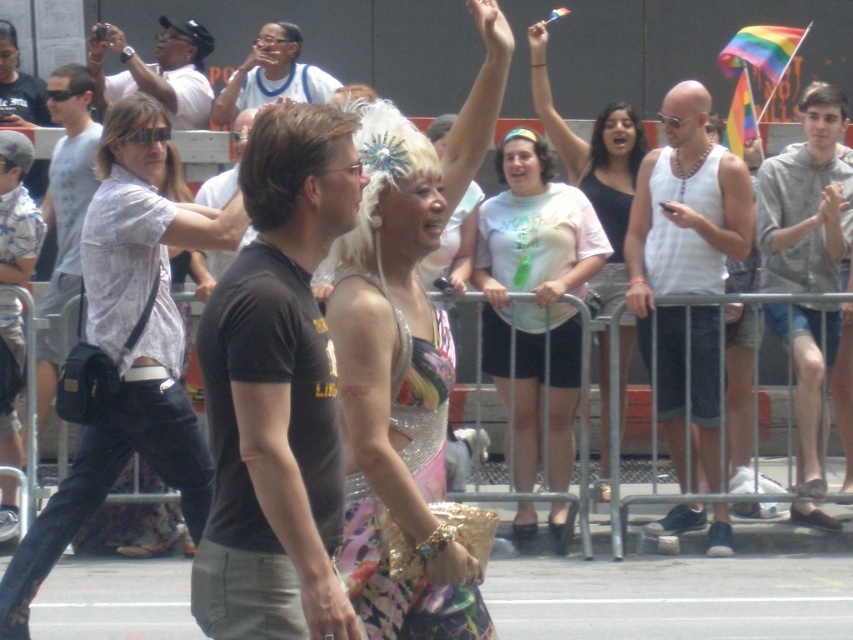
You are standing at the origin point of the coordinate system in the image. You want to move towards the shiny sequined dress at center. Which direction should you move in terms of the coordinate system?

You should move towards the positive x and positive y direction in the coordinate system since the shiny sequined dress at center is located at point (399, 580), which is in the positive quadrant relative to the origin.